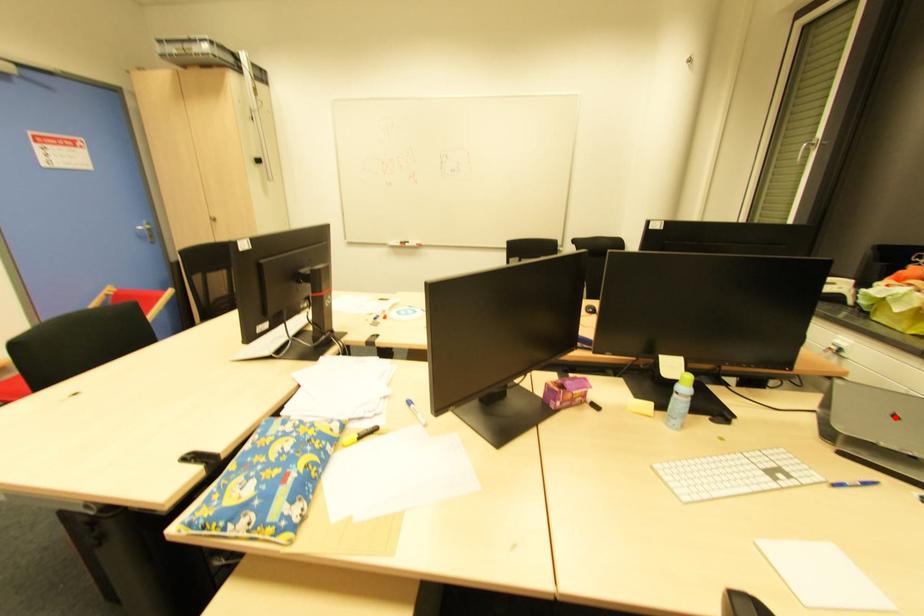
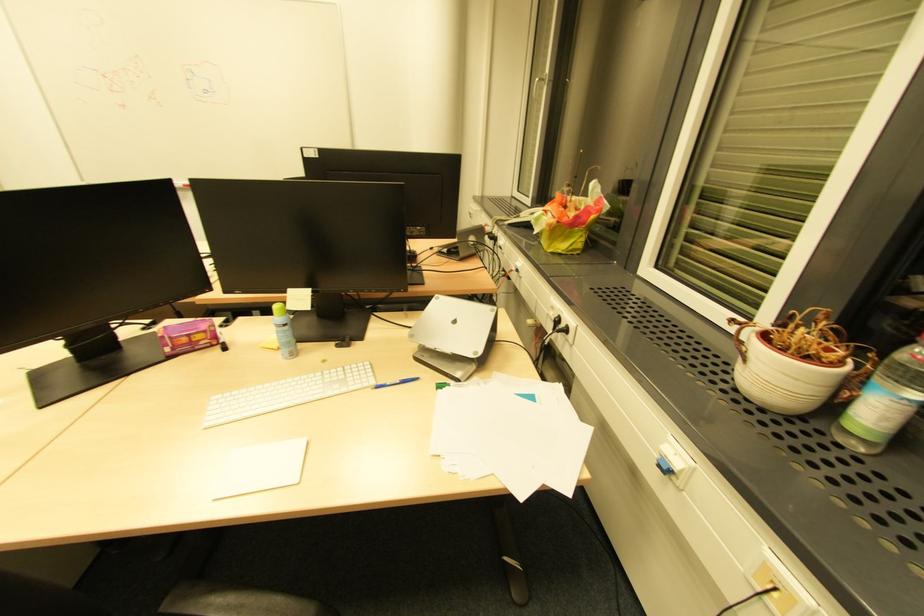
In the second image, find the point that corresponds to the highlighted location in the first image.

(455, 323)